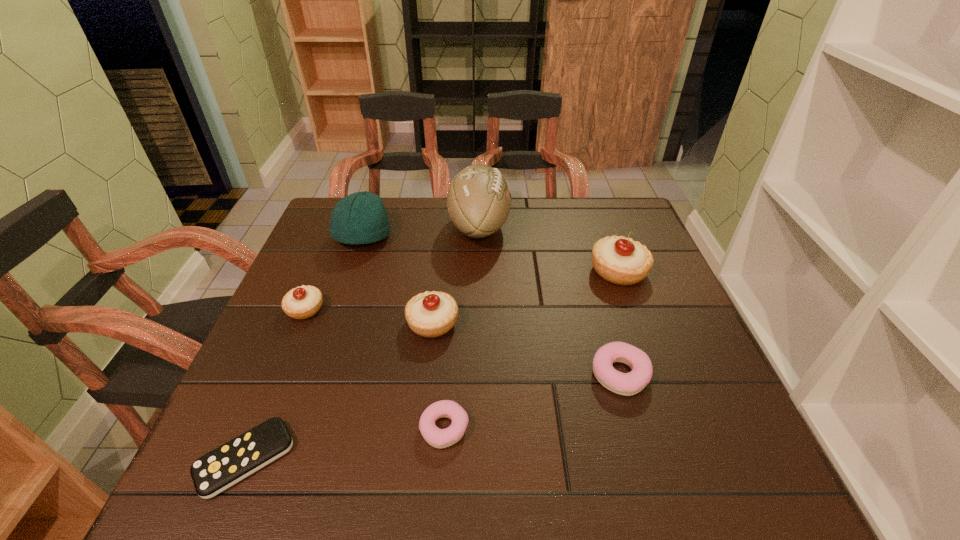
Locate an element on the screen. the left pink pastry is located at coordinates (439, 438).

Locate an element on the screen. This screenshot has width=960, height=540. the shortest pastry is located at coordinates (439, 438).

You are a GUI agent. You are given a task and a screenshot of the screen. Output one action in this format:
    pyautogui.click(x=<x>, y=<y>)
    Task: Click on the shortest object
    The height and width of the screenshot is (540, 960).
    Given the screenshot: What is the action you would take?
    pyautogui.click(x=216, y=471)

The image size is (960, 540). Identify the location of blank area located on the laces of the football (American). (633, 227).

Locate an element on the screen. The width and height of the screenshot is (960, 540). vacant point located on the right of the beanie is located at coordinates 466,237.

Where is `vacant space located 0.190m on the front of the biggest beige pastry`? Image resolution: width=960 pixels, height=540 pixels. vacant space located 0.190m on the front of the biggest beige pastry is located at coordinates (648, 352).

This screenshot has width=960, height=540. I want to click on vacant position located on the front of the fourth tallest object, so click(426, 377).

Locate an element on the screen. The height and width of the screenshot is (540, 960). vacant space located on the front of the fifth tallest object is located at coordinates (250, 443).

Identify the location of vacant region located on the front of the bigger pink pastry. (647, 466).

This screenshot has height=540, width=960. I want to click on free spot located on the back of the smaller pink pastry, so click(x=454, y=289).